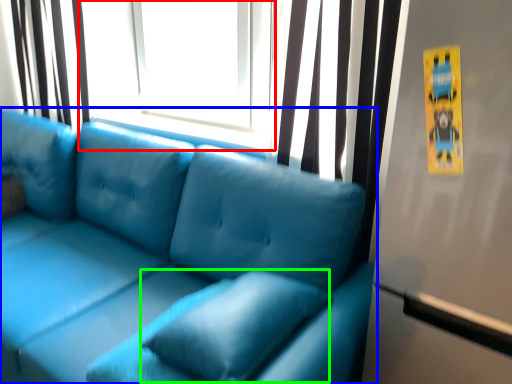
Question: Based on their relative distances, which object is nearer to window screen (highlighted by a red box)? Choose from studio couch (highlighted by a blue box) and pillow (highlighted by a green box).

Choices:
 (A) studio couch
 (B) pillow

Answer: (A)